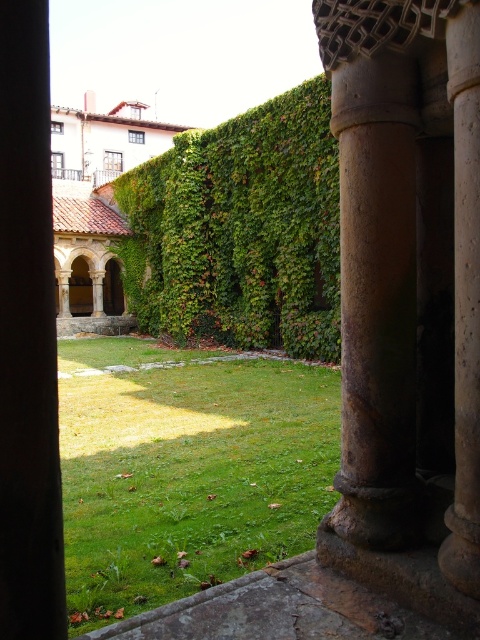
You are standing in the courtyard and want to walk towards the green leafy hedge at center. Is the green grass at center blocking your path?

The green grass at center is in front of the green leafy hedge at center, so it is blocking the path to the green leafy hedge at center.

Based on the photo, you are a gardener planning to mow the green grass at center and trim the green leafy hedge at center. Which area will require more time to maintain?

The green leafy hedge at center will require more time to maintain because it occupies more space than the green grass at center.